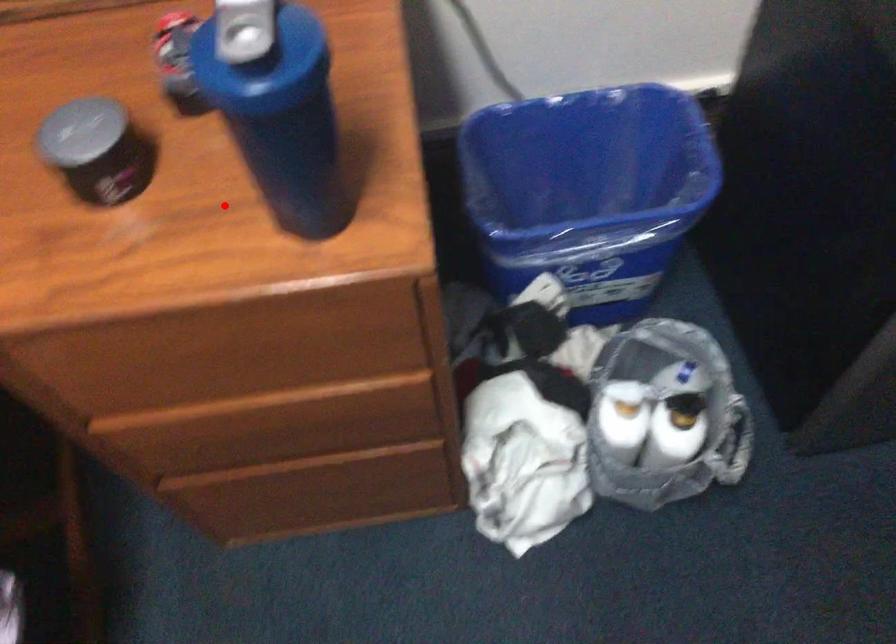
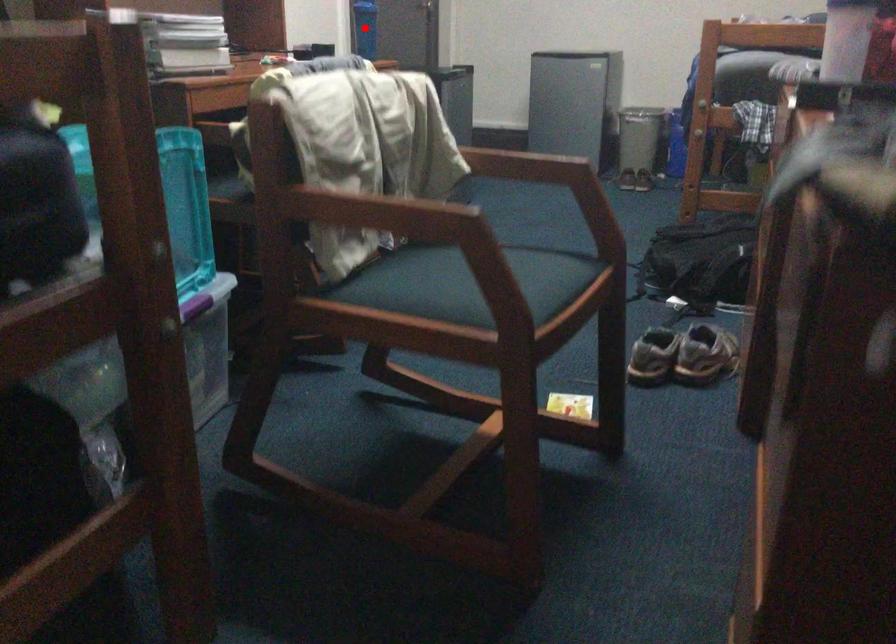
I am providing you with two images of the same scene from different viewpoints. A red point is marked on the first image and another point is marked on the second image. Are the points marked in image1 and image2 representing the same 3D position?

Yes